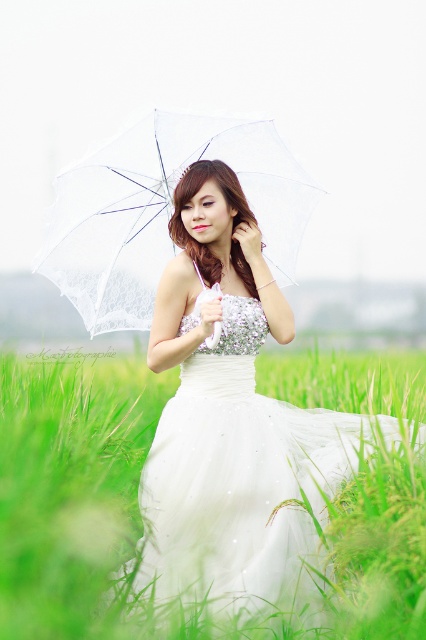
Which of these two, white satin dress at center or transparent fabric umbrella at center, stands taller?

Standing taller between the two is white satin dress at center.

You are a GUI agent. You are given a task and a screenshot of the screen. Output one action in this format:
    pyautogui.click(x=<x>, y=<y>)
    Task: Click on the white satin dress at center
    
    Given the screenshot: What is the action you would take?
    pyautogui.click(x=233, y=422)